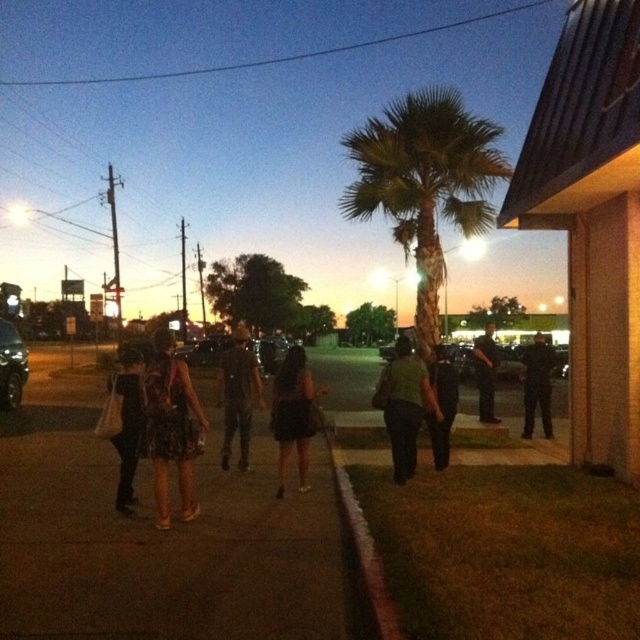
Where is the green matte dress at center located in the image?

The green matte dress at center is located at point coordinates of 0.634 and 0.633.

You are a pedestrian standing on the sidewalk and see the green leafy palm tree at center and the black uniform at center. Which object is closer to your right side?

The black uniform at center is closer to your right side because it is to the right of the green leafy palm tree at center.